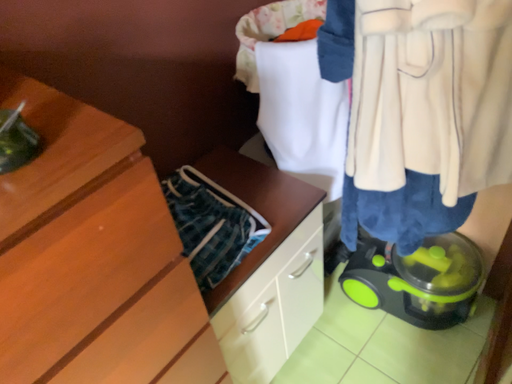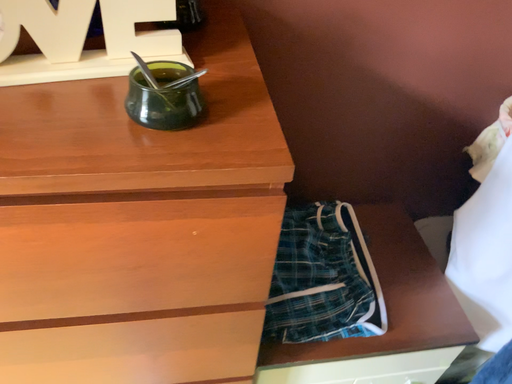
Question: Which way did the camera rotate in the video?

Choices:
 (A) rotated right
 (B) rotated left

Answer: (B)